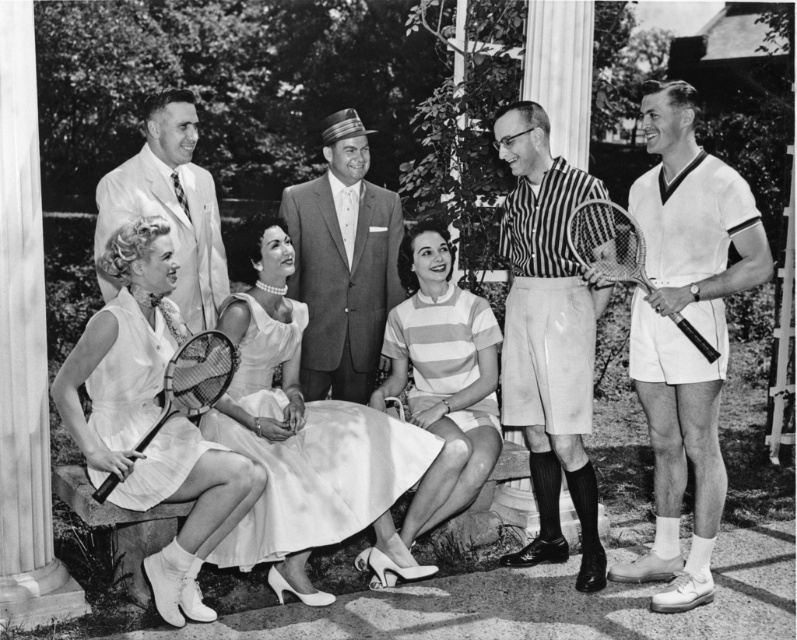
Is metallic silver tennis racket at right bigger than matte white racket at lower left?

Correct, metallic silver tennis racket at right is larger in size than matte white racket at lower left.

Can you confirm if metallic silver tennis racket at right is wider than matte white racket at lower left?

Indeed, metallic silver tennis racket at right has a greater width compared to matte white racket at lower left.

This screenshot has width=797, height=640. What are the coordinates of `metallic silver tennis racket at right` in the screenshot? It's located at (607, 243).

Image resolution: width=797 pixels, height=640 pixels. In order to click on striped cotton shirt at center in this screenshot , I will do `click(344, 262)`.

Does striped cotton shirt at center have a greater height compared to matte white racket at lower left?

Indeed, striped cotton shirt at center has a greater height compared to matte white racket at lower left.

Is point (324, 333) in front of point (226, 356)?

No.

Identify the location of striped cotton shirt at center. This screenshot has width=797, height=640. (344, 262).

Is white cotton shorts at right taller than white satin dress at left?

Yes.

Is point (673, 272) farther from camera compared to point (67, 381)?

Yes, it is behind point (67, 381).

What do you see at coordinates (682, 333) in the screenshot?
I see `white cotton shorts at right` at bounding box center [682, 333].

At what (x,y) coordinates should I click in order to perform the action: click on white cotton shorts at right. Please return your answer as a coordinate pair (x, y). Image resolution: width=797 pixels, height=640 pixels. Looking at the image, I should click on (682, 333).